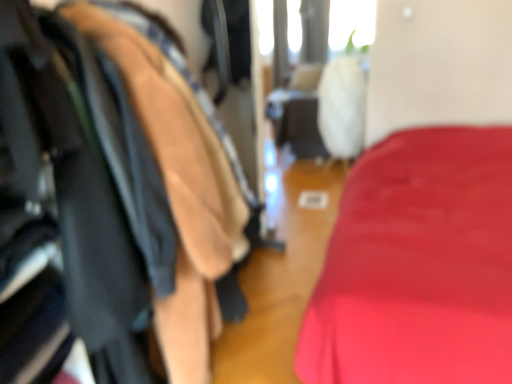
The image size is (512, 384). What do you see at coordinates (121, 183) in the screenshot?
I see `leather jacket at left` at bounding box center [121, 183].

Image resolution: width=512 pixels, height=384 pixels. Identify the location of leather jacket at left. (121, 183).

What is the approximate height of leather jacket at left?

It is 1.48 meters.

Find the location of `leather jacket at left`. leather jacket at left is located at coordinates (121, 183).